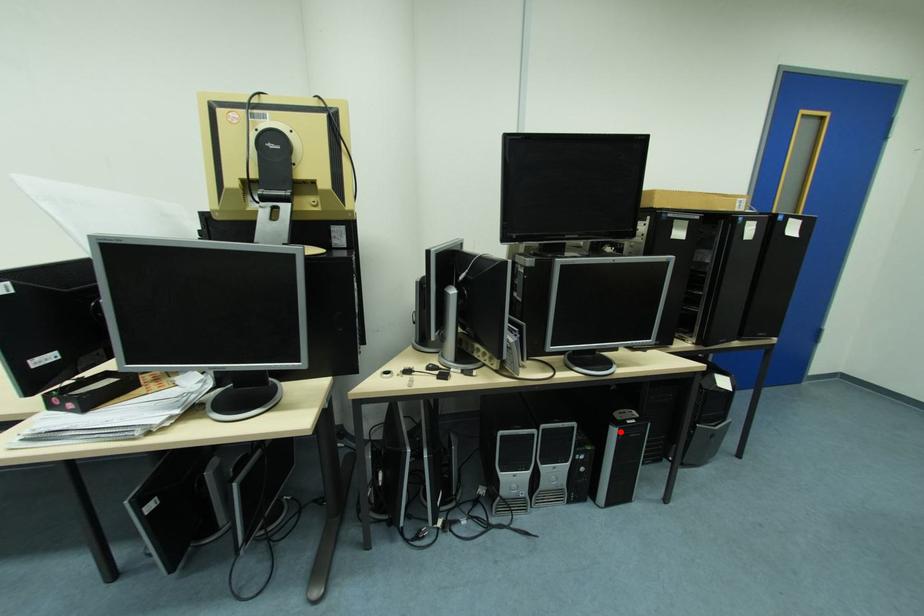
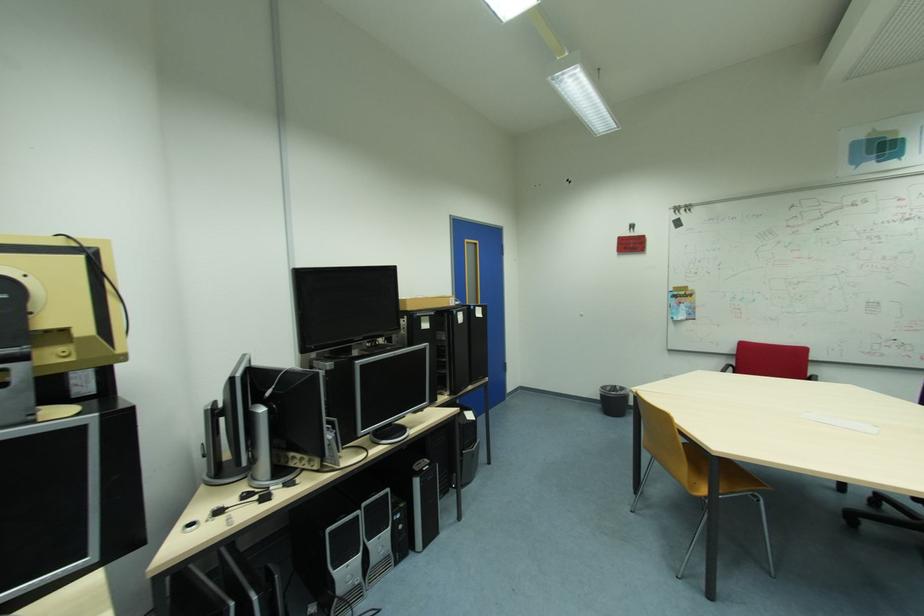
In the second image, find the point that corresponds to the highlighted location in the first image.

(424, 482)